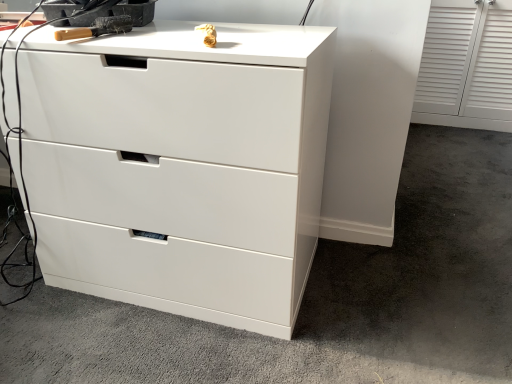
Question: Is the depth of wooden-handled brush at upper left less than that of white glossy chest of drawers at center?

Choices:
 (A) yes
 (B) no

Answer: (B)

Question: Does wooden-handled brush at upper left have a greater width compared to white glossy chest of drawers at center?

Choices:
 (A) yes
 (B) no

Answer: (B)

Question: Can you confirm if wooden-handled brush at upper left is bigger than white glossy chest of drawers at center?

Choices:
 (A) no
 (B) yes

Answer: (A)

Question: Would you say wooden-handled brush at upper left contains white glossy chest of drawers at center?

Choices:
 (A) no
 (B) yes

Answer: (A)

Question: Is wooden-handled brush at upper left to the right of white glossy chest of drawers at center from the viewer's perspective?

Choices:
 (A) no
 (B) yes

Answer: (A)

Question: From the image's perspective, is wooden-handled brush at upper left beneath white glossy chest of drawers at center?

Choices:
 (A) yes
 (B) no

Answer: (B)

Question: From the image's perspective, would you say white glossy drawer at center is positioned over wooden-handled brush at upper left?

Choices:
 (A) yes
 (B) no

Answer: (B)

Question: Can you confirm if white glossy drawer at center is positioned to the right of wooden-handled brush at upper left?

Choices:
 (A) yes
 (B) no

Answer: (A)

Question: Is white glossy drawer at center turned away from wooden-handled brush at upper left?

Choices:
 (A) yes
 (B) no

Answer: (B)

Question: Considering the relative sizes of white glossy drawer at center and wooden-handled brush at upper left in the image provided, is white glossy drawer at center taller than wooden-handled brush at upper left?

Choices:
 (A) yes
 (B) no

Answer: (A)

Question: From a real-world perspective, is white glossy drawer at center physically above wooden-handled brush at upper left?

Choices:
 (A) no
 (B) yes

Answer: (A)

Question: Considering the relative sizes of white glossy drawer at center and wooden-handled brush at upper left in the image provided, is white glossy drawer at center wider than wooden-handled brush at upper left?

Choices:
 (A) yes
 (B) no

Answer: (A)

Question: Can you confirm if white glossy drawer at center is taller than white glossy chest of drawers at center?

Choices:
 (A) yes
 (B) no

Answer: (B)